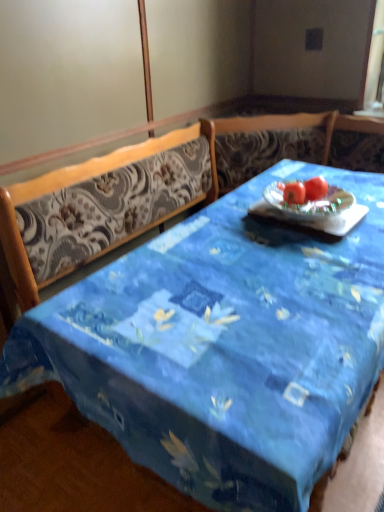
Question: From a real-world perspective, is red matte tomato at center located higher than blue fabric table at center?

Choices:
 (A) no
 (B) yes

Answer: (B)

Question: Does red matte tomato at center turn towards blue fabric table at center?

Choices:
 (A) no
 (B) yes

Answer: (B)

Question: From the image's perspective, is red matte tomato at center below blue fabric table at center?

Choices:
 (A) yes
 (B) no

Answer: (B)

Question: From the image's perspective, would you say red matte tomato at center is positioned over blue fabric table at center?

Choices:
 (A) yes
 (B) no

Answer: (A)

Question: Is red matte tomato at center positioned beyond the bounds of blue fabric table at center?

Choices:
 (A) no
 (B) yes

Answer: (A)

Question: Is red matte tomato at center smaller than blue fabric table at center?

Choices:
 (A) no
 (B) yes

Answer: (B)

Question: Does blue fabric table at center have a lesser height compared to red matte tomato at center?

Choices:
 (A) yes
 (B) no

Answer: (B)

Question: Can you confirm if blue fabric table at center is positioned to the right of red matte tomato at center?

Choices:
 (A) yes
 (B) no

Answer: (B)

Question: From a real-world perspective, is blue fabric table at center on top of red matte tomato at center?

Choices:
 (A) no
 (B) yes

Answer: (A)

Question: From the image's perspective, is blue fabric table at center located above red matte tomato at center?

Choices:
 (A) no
 (B) yes

Answer: (A)

Question: Considering the relative sizes of blue fabric table at center and red matte tomato at center in the image provided, is blue fabric table at center thinner than red matte tomato at center?

Choices:
 (A) no
 (B) yes

Answer: (A)

Question: Is blue fabric table at center completely or partially outside of red matte tomato at center?

Choices:
 (A) no
 (B) yes

Answer: (B)

Question: From the image's perspective, is red matte tomato at center under red matte tomato at center?

Choices:
 (A) yes
 (B) no

Answer: (B)